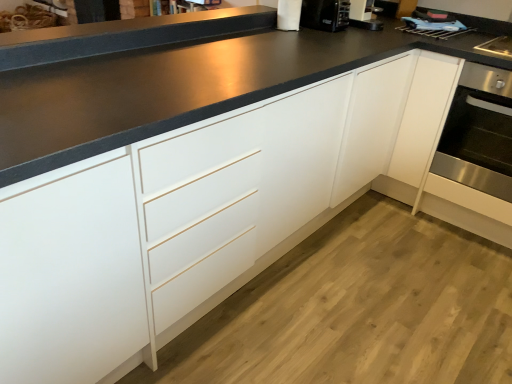
Question: Considering the relative positions of stainless steel oven at right and white paper towel at upper center in the image provided, is stainless steel oven at right to the right of white paper towel at upper center from the viewer's perspective?

Choices:
 (A) no
 (B) yes

Answer: (B)

Question: Is stainless steel oven at right facing away from white paper towel at upper center?

Choices:
 (A) no
 (B) yes

Answer: (A)

Question: Are stainless steel oven at right and white paper towel at upper center far apart?

Choices:
 (A) yes
 (B) no

Answer: (A)

Question: Is stainless steel oven at right not inside white paper towel at upper center?

Choices:
 (A) no
 (B) yes

Answer: (B)

Question: Can you confirm if stainless steel oven at right is bigger than white paper towel at upper center?

Choices:
 (A) no
 (B) yes

Answer: (B)

Question: Is stainless steel oven at right closer to camera compared to white paper towel at upper center?

Choices:
 (A) no
 (B) yes

Answer: (B)

Question: From a real-world perspective, is white paper towel at upper center located higher than black matte countertop at upper center?

Choices:
 (A) yes
 (B) no

Answer: (A)

Question: From the image's perspective, does white paper towel at upper center appear lower than black matte countertop at upper center?

Choices:
 (A) no
 (B) yes

Answer: (A)

Question: Does white paper towel at upper center have a larger size compared to black matte countertop at upper center?

Choices:
 (A) no
 (B) yes

Answer: (A)

Question: Is white paper towel at upper center far from black matte countertop at upper center?

Choices:
 (A) yes
 (B) no

Answer: (B)

Question: Considering the relative positions of white paper towel at upper center and black matte countertop at upper center in the image provided, is white paper towel at upper center to the left of black matte countertop at upper center from the viewer's perspective?

Choices:
 (A) yes
 (B) no

Answer: (B)

Question: Does white paper towel at upper center have a greater width compared to black matte countertop at upper center?

Choices:
 (A) no
 (B) yes

Answer: (A)

Question: Is black matte countertop at upper center aimed at white paper towel at upper center?

Choices:
 (A) no
 (B) yes

Answer: (A)